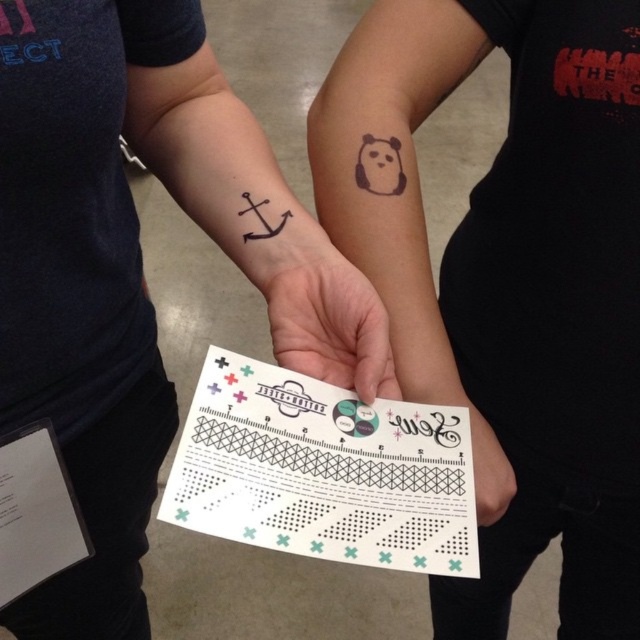
Question: Which point is closer to the camera?

Choices:
 (A) (342, 273)
 (B) (262, 234)
 (C) (490, 472)
 (D) (316, 248)

Answer: (A)

Question: Which of the following is the farthest from the observer?

Choices:
 (A) (304, 285)
 (B) (268, 228)
 (C) (396, 172)

Answer: (C)

Question: Is matte black panda at upper center smaller than black ink anchor at left?

Choices:
 (A) no
 (B) yes

Answer: (A)

Question: Does matte black panda at upper center have a larger size compared to white paper at center?

Choices:
 (A) no
 (B) yes

Answer: (B)

Question: Which point is closer to the camera?

Choices:
 (A) (275, 230)
 (B) (266, 266)
 (C) (371, 285)
 (D) (390, 182)

Answer: (C)

Question: Can you confirm if black ink anchor at upper left is positioned to the right of black matte panda at upper center?

Choices:
 (A) yes
 (B) no

Answer: (B)